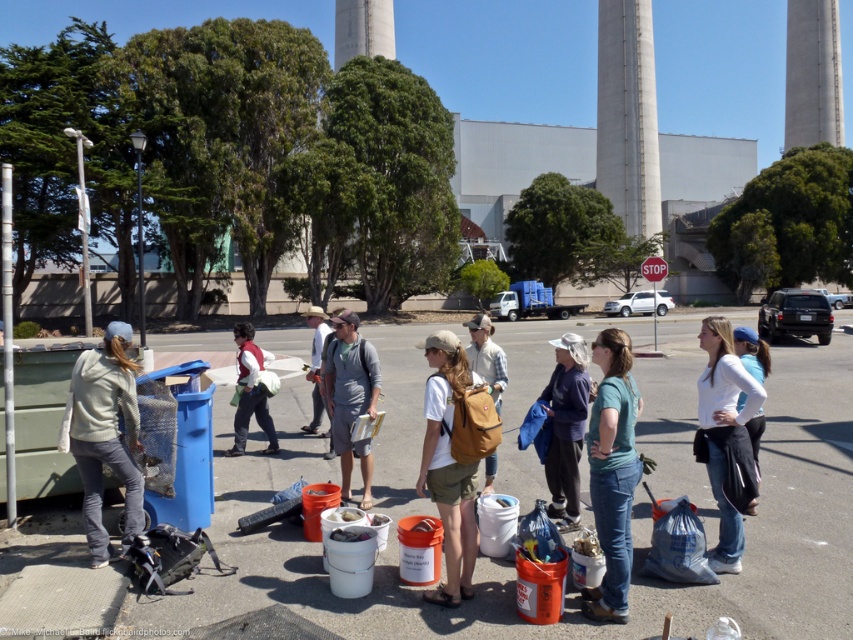
You are a safety officer at the industrial site. You need to ensure that all workers are within a 5 meter safety zone. Are both the dark blue shirt at center and the matte red vest at center within the safety zone?

The distance between the dark blue shirt at center and the matte red vest at center is 4.82 meters, which is under the 5 meter safety zone requirement. Therefore, both workers are within the required safety distance.

You are a photographer trying to capture a photo of the light gray fleece jacket at left and the matte red vest at center. Since you want both subjects to appear equally tall in the photo, which jacket should you move closer to the camera?

The light gray fleece jacket at left is much taller than the matte red vest at center, so you should move the light gray fleece jacket at left closer to the camera to make them appear the same height in the photo.

You are a photographer trying to capture a clear shot of the matte teal shirt at center and the brown leather backpack at center. Since you want both subjects to be visible, would you need to adjust your camera to focus on a wider angle to ensure both fit in the frame?

The matte teal shirt at center occupies less space than the brown leather backpack at center, so adjusting the camera to a wider angle would help ensure both subjects fit in the frame.